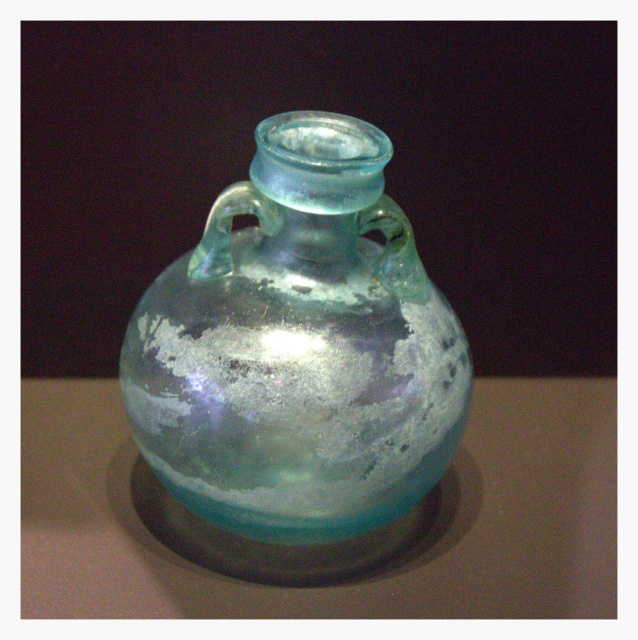
Question: Can you confirm if translucent glass vase at center is smaller than translucent glass jar at center?

Choices:
 (A) no
 (B) yes

Answer: (B)

Question: Does translucent glass vase at center have a lesser width compared to translucent glass jar at center?

Choices:
 (A) yes
 (B) no

Answer: (A)

Question: Does translucent glass vase at center appear on the left side of translucent glass jar at center?

Choices:
 (A) no
 (B) yes

Answer: (B)

Question: Which of the following is the farthest from the observer?

Choices:
 (A) (415, 454)
 (B) (63, 406)

Answer: (B)

Question: Which of the following is the closest to the observer?

Choices:
 (A) (332, 540)
 (B) (530, 524)

Answer: (A)

Question: Which object is closer to the camera taking this photo?

Choices:
 (A) translucent glass jar at center
 (B) translucent glass vase at center

Answer: (B)